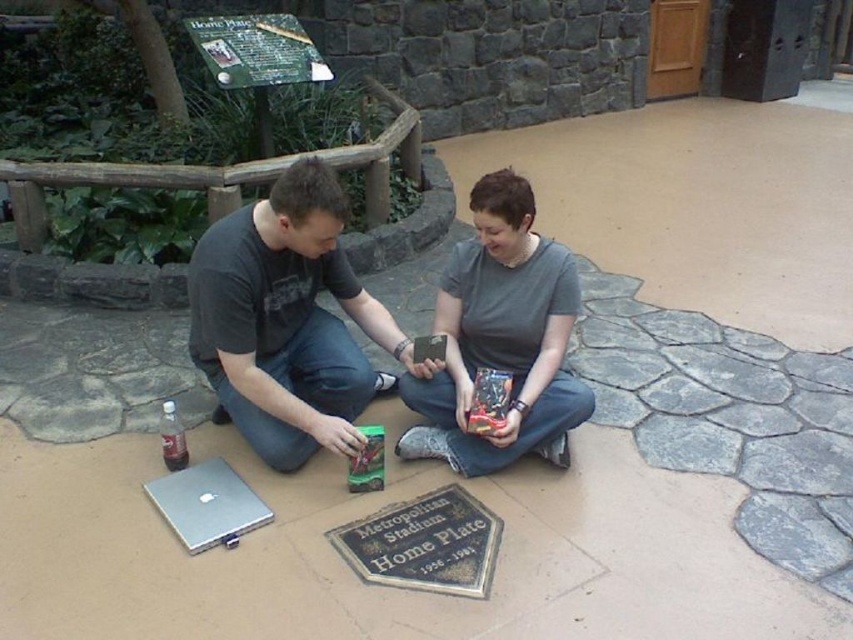
You are standing at the point labeled as point (503, 300) and want to reach the point labeled as point (312, 221). Which direction should you move to get there?

You should move forward because point (312, 221) is in front of point (503, 300).